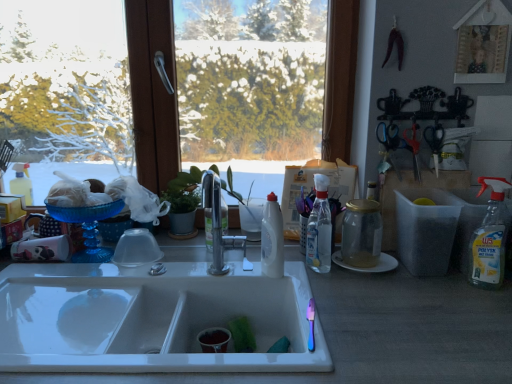
In the scene shown: What is the approximate height of transparent glass window at upper center?

transparent glass window at upper center is 84.13 centimeters tall.

Based on the photo, measure the distance between blue plastic scissors at upper right, which appears as the first scissors when viewed from the left, and camera.

1.38 meters.

I want to click on green leafy plant at center, so click(x=183, y=188).

The image size is (512, 384). Describe the element at coordinates (183, 188) in the screenshot. I see `green leafy plant at center` at that location.

The height and width of the screenshot is (384, 512). What are the coordinates of `clear glass bottle at center, the 2th bottle positioned from the left` in the screenshot? It's located at (319, 228).

Is metallic silver scissors at right, the first scissors viewed from the right, inside the boundaries of white plastic bottle at center, the first bottle in the left-to-right sequence, or outside?

metallic silver scissors at right, the first scissors viewed from the right, exists outside the volume of white plastic bottle at center, the first bottle in the left-to-right sequence.

From the metallic silver scissors at right, which ranks as the 2th scissors in left-to-right order, count 2nd bottles forward and point to it. Please provide its 2D coordinates.

[(272, 239)]

In terms of size, does metallic silver scissors at right, which ranks as the 2th scissors in left-to-right order, appear bigger or smaller than white plastic bottle at center, which is the second bottle from right to left?

In the image, metallic silver scissors at right, which ranks as the 2th scissors in left-to-right order, appears to be smaller than white plastic bottle at center, which is the second bottle from right to left.

Would you consider metallic silver scissors at right, the first scissors viewed from the right, to be distant from white plastic bottle at center, the first bottle in the left-to-right sequence?

They are positioned close to each other.

Is point (281, 234) positioned after point (490, 282)?

Yes, it is behind point (490, 282).

Based on the photo, is white plastic bottle at center, the first bottle in the left-to-right sequence, positioned with its back to clear plastic spray bottle at right?

white plastic bottle at center, the first bottle in the left-to-right sequence, does not have its back to clear plastic spray bottle at right.

From the image's perspective, would you say white plastic bottle at center, the first bottle in the left-to-right sequence, is shown under clear plastic spray bottle at right?

Yes, from the image's perspective, white plastic bottle at center, the first bottle in the left-to-right sequence, is beneath clear plastic spray bottle at right.

Is white plastic bottle at center, the first bottle in the left-to-right sequence, completely or partially outside of clear plastic spray bottle at right?

Indeed, white plastic bottle at center, the first bottle in the left-to-right sequence, is completely outside clear plastic spray bottle at right.

Are transparent glass window at upper center and blue plastic scissors at upper right, arranged as the second scissors when viewed from the right, located far from each other?

transparent glass window at upper center is near blue plastic scissors at upper right, arranged as the second scissors when viewed from the right, not far away.

Between transparent glass window at upper center and blue plastic scissors at upper right, arranged as the second scissors when viewed from the right, which one appears on the right side from the viewer's perspective?

blue plastic scissors at upper right, arranged as the second scissors when viewed from the right, is more to the right.

Between transparent glass window at upper center and blue plastic scissors at upper right, arranged as the second scissors when viewed from the right, which one has larger width?

Wider between the two is transparent glass window at upper center.

Between transparent glass window at upper center and blue plastic scissors at upper right, which appears as the first scissors when viewed from the left, which one has larger size?

With larger size is transparent glass window at upper center.

This screenshot has width=512, height=384. What are the coordinates of `counter top below the transparent glass window at upper center (from the image's perspective)` in the screenshot? It's located at (x=379, y=334).

Can you confirm if transparent glass window at upper center is wider than white ceramic sink at center?

In fact, transparent glass window at upper center might be narrower than white ceramic sink at center.

Would you consider transparent glass window at upper center to be distant from white ceramic sink at center?

That's not correct — transparent glass window at upper center is a little close to white ceramic sink at center.

Is transparent glass window at upper center not within white ceramic sink at center?

Yes, transparent glass window at upper center is located beyond the bounds of white ceramic sink at center.

Who is shorter, transparent glass window at upper center or green leafy plant at center?

green leafy plant at center.

Is transparent glass window at upper center surrounding green leafy plant at center?

Yes, green leafy plant at center is a part of transparent glass window at upper center.

Is transparent glass window at upper center not near green leafy plant at center?

No, transparent glass window at upper center is in close proximity to green leafy plant at center.

What's the angular difference between white ceramic sink at center and metallic silver scissors at right, the first scissors viewed from the right,'s facing directions?

There is a 7.08-degree angle between the facing directions of white ceramic sink at center and metallic silver scissors at right, the first scissors viewed from the right.

Does white ceramic sink at center turn towards metallic silver scissors at right, which ranks as the 2th scissors in left-to-right order?

No, white ceramic sink at center is not turned towards metallic silver scissors at right, which ranks as the 2th scissors in left-to-right order.

Image resolution: width=512 pixels, height=384 pixels. I want to click on counter top below the metallic silver scissors at right, the first scissors viewed from the right (from the image's perspective), so click(x=379, y=334).

Are white ceramic sink at center and metallic silver scissors at right, the first scissors viewed from the right, located far from each other?

white ceramic sink at center is near metallic silver scissors at right, the first scissors viewed from the right, not far away.

Looking at this image, based on their sizes in the image, would you say metallic silver scissors at right, which ranks as the 2th scissors in left-to-right order, is bigger or smaller than clear plastic spray bottle at right?

Clearly, metallic silver scissors at right, which ranks as the 2th scissors in left-to-right order, is smaller in size than clear plastic spray bottle at right.

From a real-world perspective, is metallic silver scissors at right, the first scissors viewed from the right, located higher than clear plastic spray bottle at right?

Indeed, from a real-world perspective, metallic silver scissors at right, the first scissors viewed from the right, stands above clear plastic spray bottle at right.

Is metallic silver scissors at right, the first scissors viewed from the right, looking in the opposite direction of clear plastic spray bottle at right?

metallic silver scissors at right, the first scissors viewed from the right, does not have its back to clear plastic spray bottle at right.

Between point (418, 164) and point (503, 265), which one is positioned in front?

The point (503, 265) is more forward.

Starting from the white plastic bottle at center, the first bottle in the left-to-right sequence, which scissors is the 2nd one to the right? Please provide its 2D coordinates.

[(414, 149)]

Locate an element on the screen. The image size is (512, 384). bottle below the clear plastic spray bottle at right (from the image's perspective) is located at coordinates (272, 239).

From the image, which object appears to be farther from clear glass bottle at center, the 2th bottle positioned from the left, clear plastic spray bottle at right or transparent glass window at upper center?

The object further to clear glass bottle at center, the 2th bottle positioned from the left, is transparent glass window at upper center.

Which object lies further to the anchor point blue plastic scissors at upper right, arranged as the second scissors when viewed from the right, white plastic bottle at center, the first bottle in the left-to-right sequence, or transparent glass window at upper center?

transparent glass window at upper center is positioned further to the anchor blue plastic scissors at upper right, arranged as the second scissors when viewed from the right.

From the image, which object appears to be nearer to green leafy plant at center, white ceramic sink at center or blue plastic scissors at upper right, arranged as the second scissors when viewed from the right?

Among the two, blue plastic scissors at upper right, arranged as the second scissors when viewed from the right, is located nearer to green leafy plant at center.

Which object lies further to the anchor point transparent glass window at upper center, clear plastic spray bottle at right or white ceramic sink at center?

clear plastic spray bottle at right is positioned further to the anchor transparent glass window at upper center.

Based on the photo, considering their positions, is green leafy plant at center positioned further to clear plastic spray bottle at right than transparent glass window at upper center?

Among the two, transparent glass window at upper center is located further to clear plastic spray bottle at right.

Which object lies further to the anchor point blue plastic scissors at upper right, which appears as the first scissors when viewed from the left, white plastic bottle at center, which is the second bottle from right to left, or metallic silver scissors at right, which ranks as the 2th scissors in left-to-right order?

The object further to blue plastic scissors at upper right, which appears as the first scissors when viewed from the left, is white plastic bottle at center, which is the second bottle from right to left.

Based on their spatial positions, is transparent glass window at upper center or clear glass bottle at center, marked as the first bottle in a right-to-left arrangement, closer to white ceramic sink at center?

clear glass bottle at center, marked as the first bottle in a right-to-left arrangement, is closer to white ceramic sink at center.

From the picture: From the image, which object appears to be nearer to blue plastic scissors at upper right, which appears as the first scissors when viewed from the left, metallic silver scissors at right, the first scissors viewed from the right, or green leafy plant at center?

metallic silver scissors at right, the first scissors viewed from the right, is positioned closer to the anchor blue plastic scissors at upper right, which appears as the first scissors when viewed from the left.

You are a GUI agent. You are given a task and a screenshot of the screen. Output one action in this format:
    pyautogui.click(x=<x>, y=<y>)
    Task: Click on the bottle between green leafy plant at center and clear glass bottle at center, marked as the first bottle in a right-to-left arrangement
    The width and height of the screenshot is (512, 384).
    Given the screenshot: What is the action you would take?
    pyautogui.click(x=272, y=239)

You are a GUI agent. You are given a task and a screenshot of the screen. Output one action in this format:
    pyautogui.click(x=<x>, y=<y>)
    Task: Click on the scissors situated between green leafy plant at center and metallic silver scissors at right, the first scissors viewed from the right, from left to right
    
    Given the screenshot: What is the action you would take?
    pyautogui.click(x=390, y=142)

Identify the location of plant between transparent glass window at upper center and clear plastic spray bottle at right from left to right. (183, 188).

Image resolution: width=512 pixels, height=384 pixels. What are the coordinates of `plant between white ceramic sink at center and metallic silver scissors at right, the first scissors viewed from the right, in the horizontal direction` in the screenshot? It's located at (183, 188).